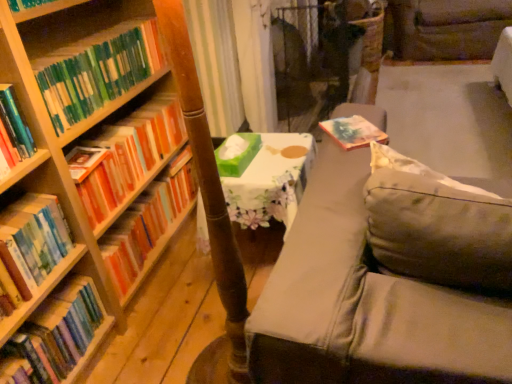
Question: From the image's perspective, is hardcover books at left, the 1th book when ordered from bottom to top, on orange matte bookshelf at left, the 3th book viewed from the top?

Choices:
 (A) yes
 (B) no

Answer: (B)

Question: From the image's perspective, is hardcover books at left, the 1th book when ordered from bottom to top, under orange matte bookshelf at left, which appears as the third book when ordered from the bottom?

Choices:
 (A) yes
 (B) no

Answer: (A)

Question: Considering the relative sizes of hardcover books at left, the 1th book when ordered from bottom to top, and orange matte bookshelf at left, which appears as the third book when ordered from the bottom, in the image provided, is hardcover books at left, the 1th book when ordered from bottom to top, shorter than orange matte bookshelf at left, which appears as the third book when ordered from the bottom,?

Choices:
 (A) no
 (B) yes

Answer: (B)

Question: Is hardcover books at left, arranged as the fifth book when viewed from the top, facing away from orange matte bookshelf at left, which appears as the third book when ordered from the bottom?

Choices:
 (A) no
 (B) yes

Answer: (A)

Question: Considering the relative positions of hardcover books at left, arranged as the fifth book when viewed from the top, and orange matte bookshelf at left, which appears as the third book when ordered from the bottom, in the image provided, is hardcover books at left, arranged as the fifth book when viewed from the top, in front of orange matte bookshelf at left, which appears as the third book when ordered from the bottom,?

Choices:
 (A) yes
 (B) no

Answer: (A)

Question: Is hardcover books at left, the 1th book when ordered from bottom to top, bigger than orange matte bookshelf at left, the 3th book viewed from the top?

Choices:
 (A) no
 (B) yes

Answer: (A)

Question: From the image's perspective, is orange matte bookshelf at left, the 3th book viewed from the top, over green matte bookshelf at left, marked as the first book in a top-to-bottom arrangement?

Choices:
 (A) no
 (B) yes

Answer: (A)

Question: Does orange matte bookshelf at left, which appears as the third book when ordered from the bottom, come in front of green matte bookshelf at left, marked as the fifth book in a bottom-to-top arrangement?

Choices:
 (A) no
 (B) yes

Answer: (A)

Question: Is orange matte bookshelf at left, which appears as the third book when ordered from the bottom, wider than green matte bookshelf at left, marked as the fifth book in a bottom-to-top arrangement?

Choices:
 (A) yes
 (B) no

Answer: (B)

Question: Is orange matte bookshelf at left, which appears as the third book when ordered from the bottom, facing away from green matte bookshelf at left, marked as the first book in a top-to-bottom arrangement?

Choices:
 (A) no
 (B) yes

Answer: (A)

Question: Considering the relative sizes of orange matte bookshelf at left, which appears as the third book when ordered from the bottom, and green matte bookshelf at left, marked as the fifth book in a bottom-to-top arrangement, in the image provided, is orange matte bookshelf at left, which appears as the third book when ordered from the bottom, taller than green matte bookshelf at left, marked as the fifth book in a bottom-to-top arrangement,?

Choices:
 (A) yes
 (B) no

Answer: (A)

Question: From a real-world perspective, is orange matte bookshelf at left, which appears as the third book when ordered from the bottom, over green matte bookshelf at left, marked as the first book in a top-to-bottom arrangement?

Choices:
 (A) yes
 (B) no

Answer: (B)

Question: Would you consider hardcover books at left, the fourth book when ordered from bottom to top, to be distant from green matte bookshelf at left, marked as the fifth book in a bottom-to-top arrangement?

Choices:
 (A) no
 (B) yes

Answer: (A)